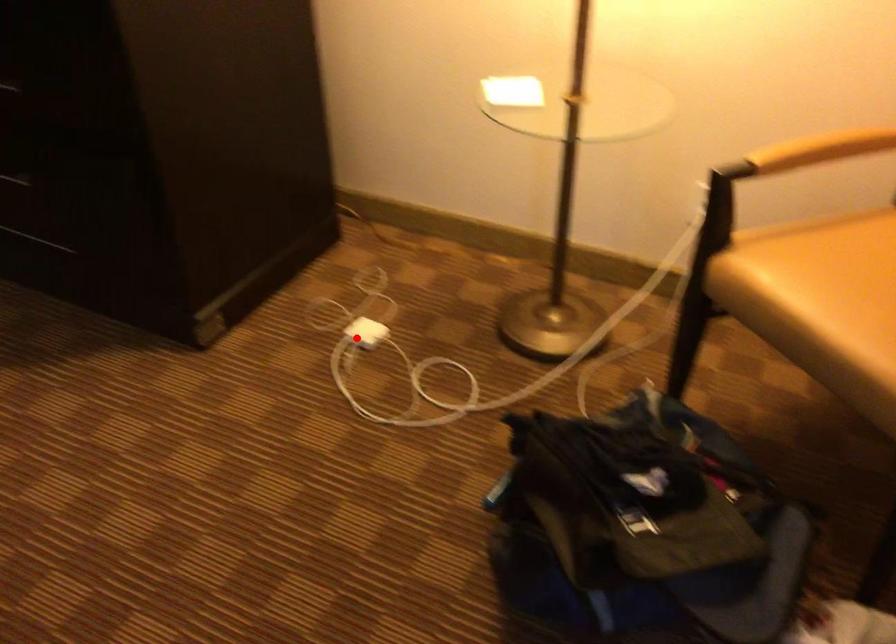
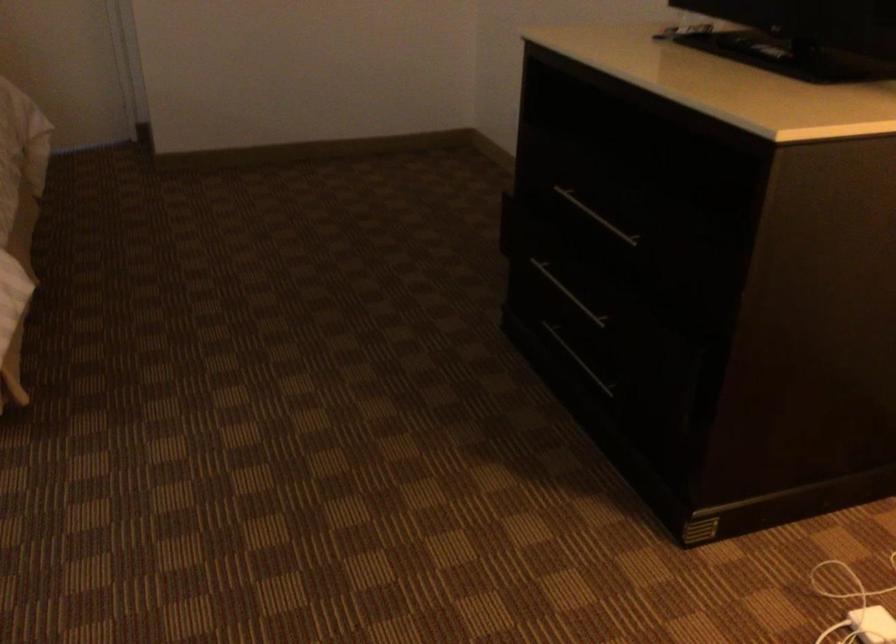
In the second image, find the point that corresponds to the highlighted location in the first image.

(872, 625)